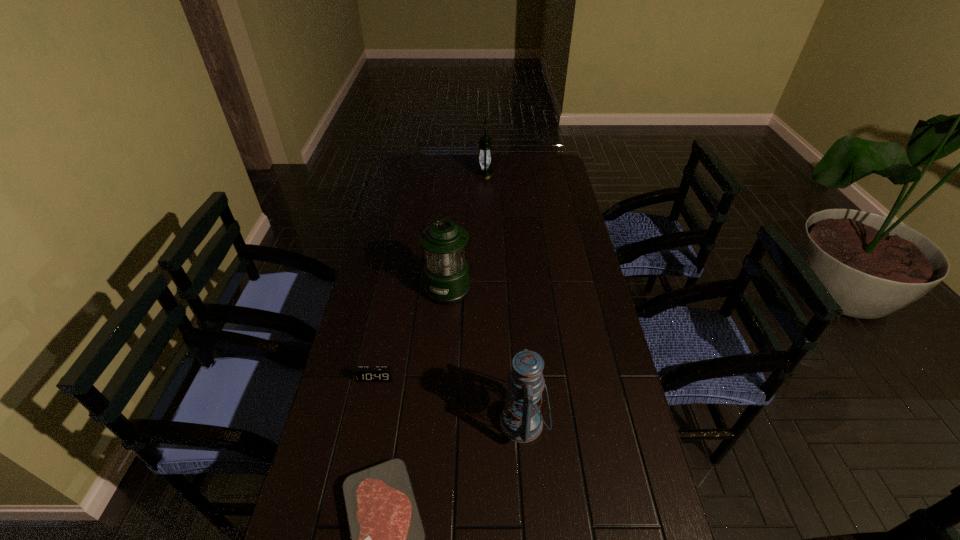
At what (x,y) coordinates should I click in order to perform the action: click on free space that is in between the farthest lantern and the nearest lantern. Please return your answer as a coordinate pair (x, y). The image size is (960, 540). Looking at the image, I should click on (504, 298).

You are a GUI agent. You are given a task and a screenshot of the screen. Output one action in this format:
    pyautogui.click(x=<x>, y=<y>)
    Task: Click on the free space between the nearest lantern and the farthest lantern
    Image resolution: width=960 pixels, height=540 pixels.
    Given the screenshot: What is the action you would take?
    pyautogui.click(x=504, y=298)

Locate an element on the screen. free area in between the second nearest object and the farthest object is located at coordinates (504, 298).

This screenshot has height=540, width=960. Identify the location of vacant area that lies between the fourth nearest object and the nearest lantern. (486, 355).

This screenshot has height=540, width=960. I want to click on free space that is in between the fourth farthest object and the third farthest object, so click(x=449, y=400).

In order to click on unoccupied area between the second nearest object and the farthest object in this screenshot , I will do click(x=504, y=298).

Select which object is the closest to the steak. Please provide its 2D coordinates. Your answer should be formatted as a tuple, i.e. [(x, y)], where the tuple contains the x and y coordinates of a point satisfying the conditions above.

[(521, 421)]

Image resolution: width=960 pixels, height=540 pixels. Identify the location of object that is the closest to the steak. (521, 421).

The width and height of the screenshot is (960, 540). What are the coordinates of `lantern that is the closest to the nearest lantern` in the screenshot? It's located at (446, 273).

Find the location of a particular element. The height and width of the screenshot is (540, 960). lantern that is the third closest one to the third nearest object is located at coordinates (484, 171).